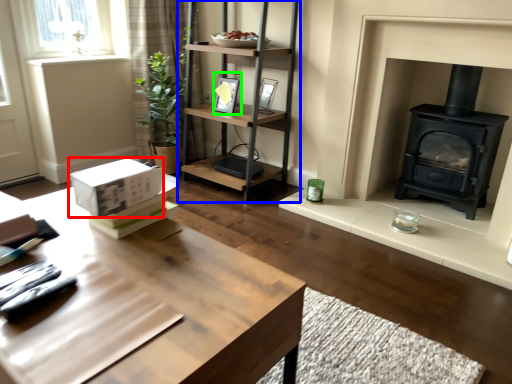
Question: Estimate the real-world distances between objects in this image. Which object is farther from cardboard box (highlighted by a red box), shelf (highlighted by a blue box) or picture frame (highlighted by a green box)?

Choices:
 (A) shelf
 (B) picture frame

Answer: (B)